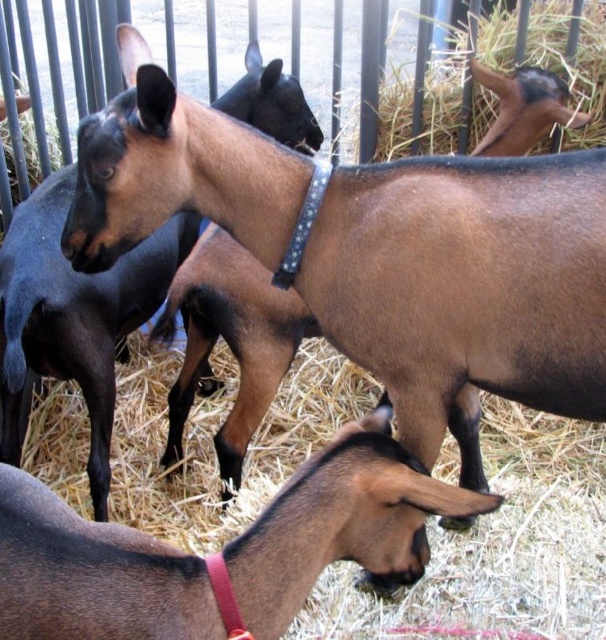
Question: Which of these objects is positioned farthest from the brown matte goat at center?

Choices:
 (A) brown matte goat at lower left
 (B) brown matte goat at upper right
 (C) brown straw at upper right
 (D) brown matte goat at upper center

Answer: (C)

Question: In this image, where is brown straw at upper right located relative to brown matte goat at upper right?

Choices:
 (A) left
 (B) right

Answer: (A)

Question: Considering the real-world distances, which object is closest to the brown matte goat at upper right?

Choices:
 (A) brown matte goat at center
 (B) brown matte goat at lower left

Answer: (A)

Question: Is brown matte goat at lower left thinner than brown straw at upper right?

Choices:
 (A) no
 (B) yes

Answer: (B)

Question: Which object is positioned farthest from the brown matte goat at center?

Choices:
 (A) brown matte goat at upper center
 (B) brown matte goat at upper right
 (C) brown straw at upper right
 (D) brown matte goat at lower left

Answer: (C)

Question: Is brown matte goat at upper center behind brown straw at upper right?

Choices:
 (A) no
 (B) yes

Answer: (A)